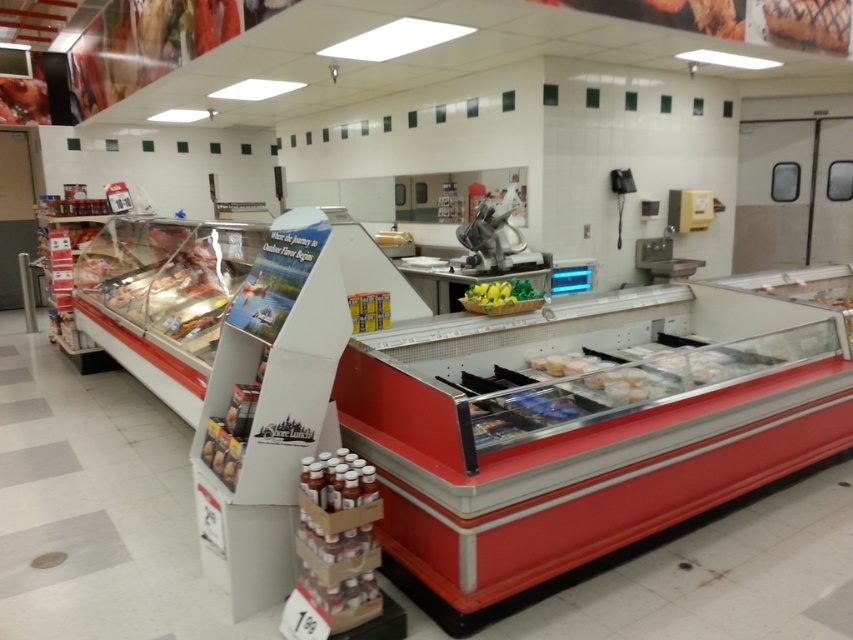
Question: In this image, where is grilled meat at upper right located relative to yellow-green plastic basket at center?

Choices:
 (A) left
 (B) right

Answer: (B)

Question: Does matte plastic bagel at upper left appear over yellow-green plastic basket at center?

Choices:
 (A) no
 (B) yes

Answer: (B)

Question: Which point is farther to the camera?

Choices:
 (A) yellow-green plastic basket at center
 (B) smooth glossy meat at upper left
 (C) translucent plastic meat at left

Answer: (B)

Question: Which object is closer to the camera taking this photo?

Choices:
 (A) smooth glossy meat at upper left
 (B) translucent plastic meat at left

Answer: (B)

Question: Among these points, which one is farthest from the camera?

Choices:
 (A) (1, 102)
 (B) (811, 0)
 (C) (459, 300)

Answer: (A)

Question: Considering the relative positions of grilled meat at upper right and smooth glossy meat at upper left in the image provided, where is grilled meat at upper right located with respect to smooth glossy meat at upper left?

Choices:
 (A) left
 (B) right

Answer: (B)